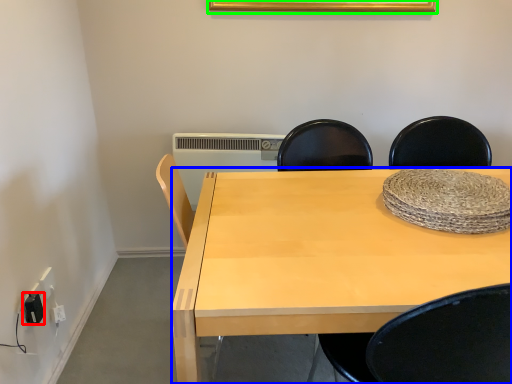
Question: Estimate the real-world distances between objects in this image. Which object is farther from electric outlet (highlighted by a red box), desk (highlighted by a blue box) or picture frame (highlighted by a green box)?

Choices:
 (A) desk
 (B) picture frame

Answer: (B)